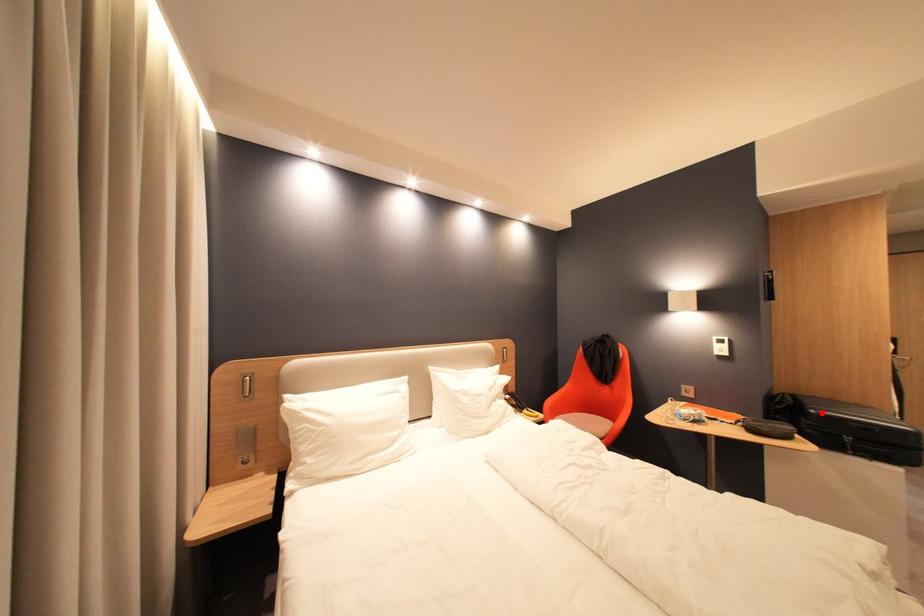
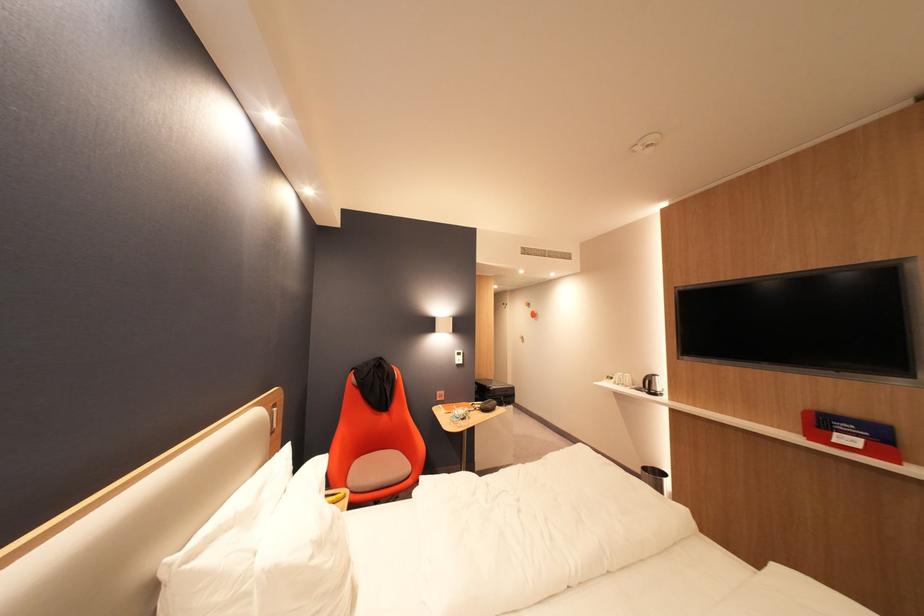
Where in the second image is the point corresponding to the highlighted location from the first image?

(502, 390)